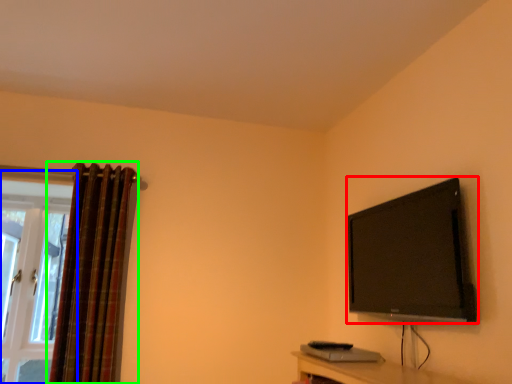
Question: Estimate the real-world distances between objects in this image. Which object is farther from television (highlighted by a red box), window (highlighted by a blue box) or curtain (highlighted by a green box)?

Choices:
 (A) window
 (B) curtain

Answer: (A)